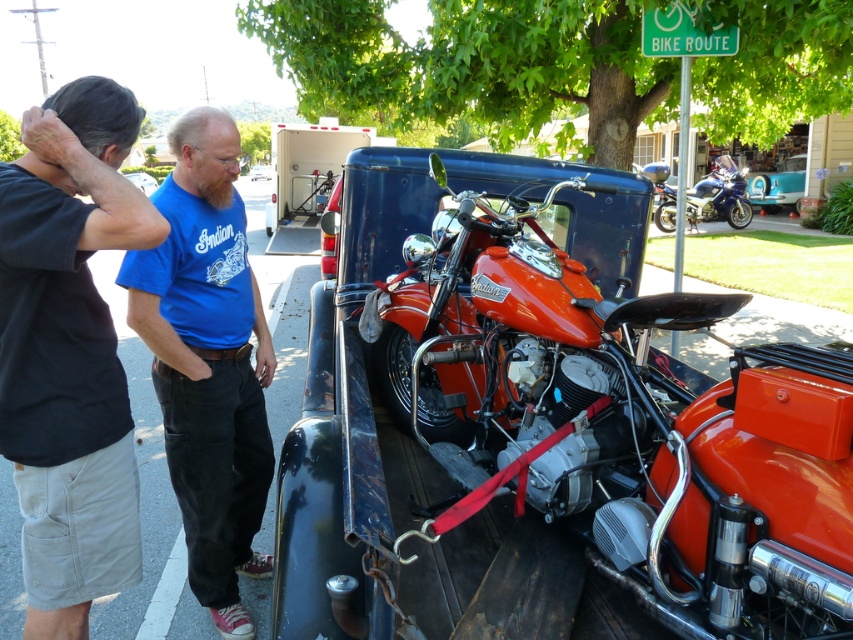
You are standing in front of the metallic blue truck at center and want to move to the shiny metallic motorcycle at upper right. Which direction should you face to walk towards it?

You should face to the right because the shiny metallic motorcycle at upper right is to the right of the metallic blue truck at center.

You are a photographer trying to capture a photo of both the blue cotton shirt at center and the blue cotton shirt at upper left in the scene. Can you fit both shirts into the frame without moving the camera? Explain your reasoning based on their positions.

The blue cotton shirt at center is located below the blue cotton shirt at upper left, so as long as the camera frame can encompass both the upper and lower positions, both shirts can be included without moving the camera.

You are a delivery driver who needs to park the metallic blue truck at center and the shiny metallic motorcycle at upper right in a parking lot with limited space. The parking spaces are 2 meters wide. Can both vehicles fit side by side in the same parking space?

The metallic blue truck at center is wider than the shiny metallic motorcycle at upper right. Since the parking space is only 2 meters wide, it is unlikely both vehicles can fit side by side as the truck alone may exceed the space requirements.